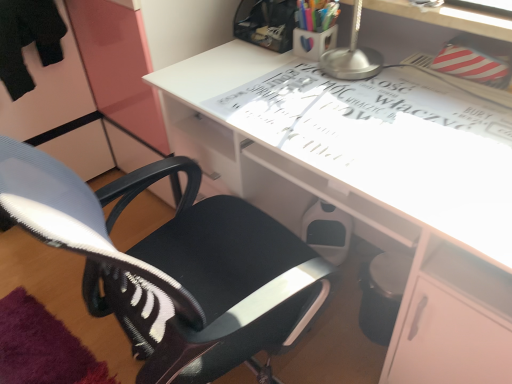
Question: Considering the positions of matte plastic cup at upper center, which appears as the 2th stationery when viewed from the top, and white glossy desk at center in the image, is matte plastic cup at upper center, which appears as the 2th stationery when viewed from the top, wider or thinner than white glossy desk at center?

Choices:
 (A) thin
 (B) wide

Answer: (A)

Question: Considering the positions of matte plastic cup at upper center, the first stationery in the bottom-to-top sequence, and white glossy desk at center in the image, is matte plastic cup at upper center, the first stationery in the bottom-to-top sequence, taller or shorter than white glossy desk at center?

Choices:
 (A) tall
 (B) short

Answer: (B)

Question: Considering the real-world distances, which object is closest to the black fabric chair at center?

Choices:
 (A) translucent plastic cup at upper center, acting as the 1th stationery starting from the top
 (B) white glossy desk at center
 (C) matte plastic cup at upper center, the first stationery in the bottom-to-top sequence

Answer: (B)

Question: Estimate the real-world distances between objects in this image. Which object is farther from the matte plastic cup at upper center, the first stationery in the bottom-to-top sequence?

Choices:
 (A) black fabric chair at center
 (B) white glossy desk at center
 (C) translucent plastic cup at upper center, marked as the 2th stationery in a bottom-to-top arrangement

Answer: (A)